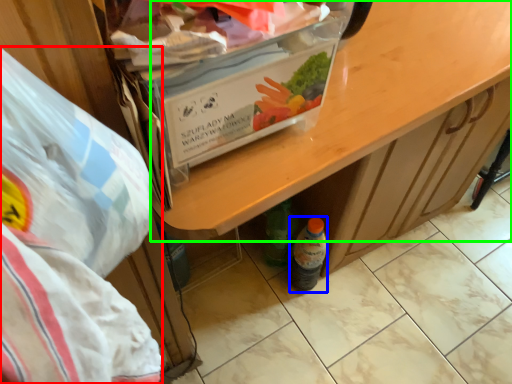
Question: Which is farther away from waste (highlighted by a red box)? bottle (highlighted by a blue box) or desk (highlighted by a green box)?

Choices:
 (A) bottle
 (B) desk

Answer: (A)